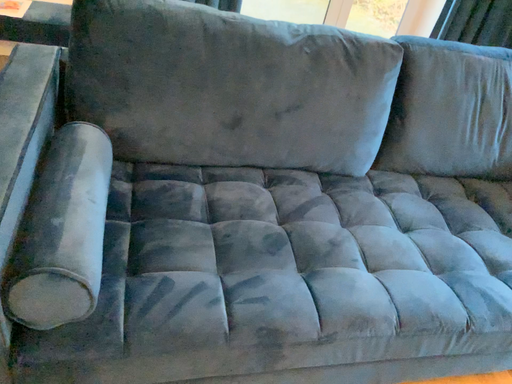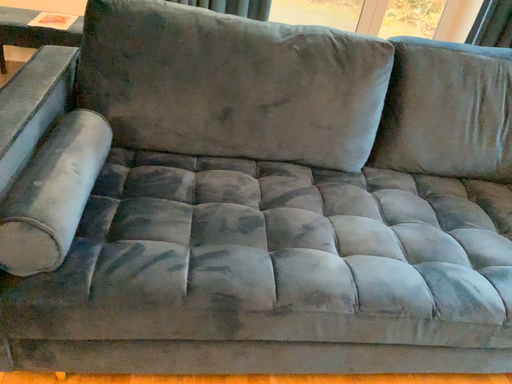
Question: How did the camera likely rotate when shooting the video?

Choices:
 (A) rotated left
 (B) rotated right

Answer: (A)